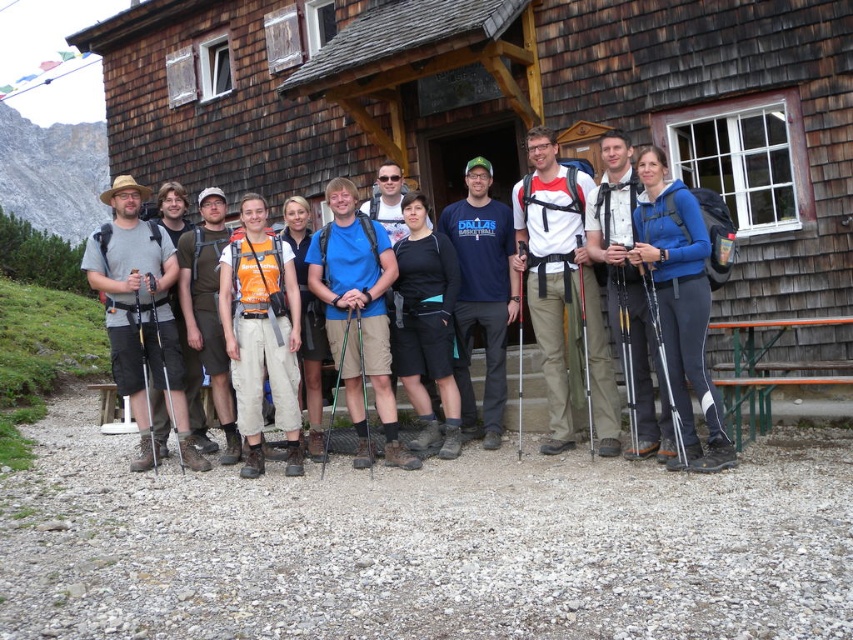
Question: Which point is farther to the camera?

Choices:
 (A) (332, 417)
 (B) (686, 358)

Answer: (A)

Question: Which object is closer to the camera taking this photo?

Choices:
 (A) black matte shorts at center
 (B) blue fleece jacket at center
 (C) green metallic ski pole at center
 (D) matte black backpack at center

Answer: (B)

Question: Is blue cotton t-shirt at center wider than black rubber ski pole at left?

Choices:
 (A) no
 (B) yes

Answer: (B)

Question: Is matte black backpack at center bigger than black plastic ski pole at left?

Choices:
 (A) yes
 (B) no

Answer: (A)

Question: Which point is closer to the camera?

Choices:
 (A) (579, 310)
 (B) (520, 387)
 (C) (181, 348)
 (D) (450, 364)

Answer: (A)

Question: Is the position of blue fleece jacket at center less distant than that of silver metallic ski pole at center?

Choices:
 (A) yes
 (B) no

Answer: (A)